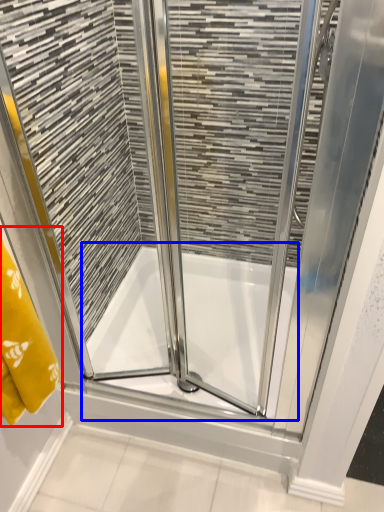
Question: Which of the following is the closest to the observer, bath towel (highlighted by a red box) or bath (highlighted by a blue box)?

Choices:
 (A) bath towel
 (B) bath

Answer: (A)